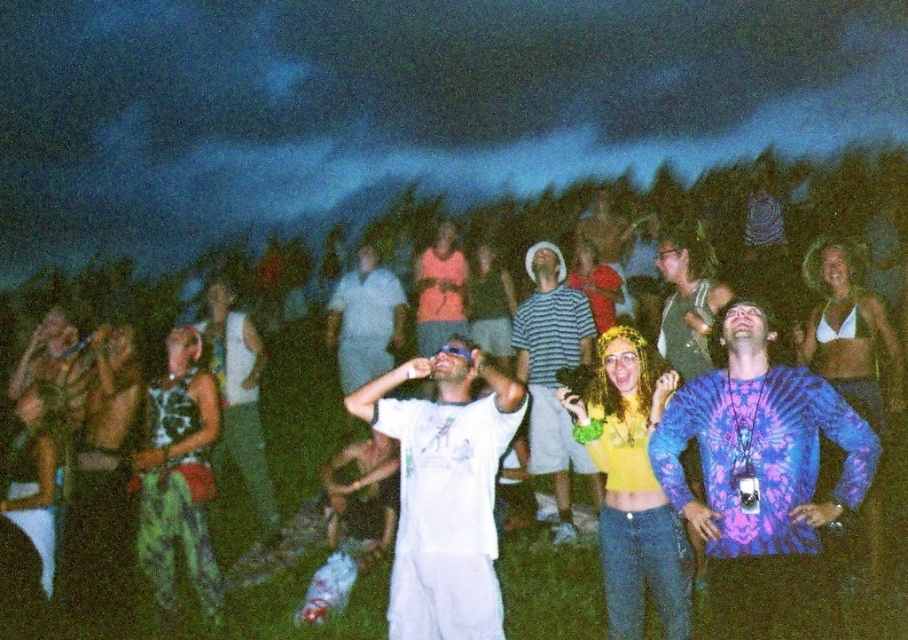
Question: In this image, where is tie-dye fabric shirt at right located relative to striped cotton shirt at center?

Choices:
 (A) left
 (B) right

Answer: (B)

Question: Does striped cotton shirt at center come in front of white cotton shirt at center?

Choices:
 (A) yes
 (B) no

Answer: (A)

Question: Which object is the closest to the striped cotton shirt at center?

Choices:
 (A) tie-dye fabric shirt at right
 (B) white cotton t-shirt at center

Answer: (B)

Question: Among these points, which one is farthest from the camera?

Choices:
 (A) (356, 276)
 (B) (551, 420)
 (C) (775, 472)
 (D) (454, 400)

Answer: (A)

Question: Which is farther from the striped cotton shirt at center?

Choices:
 (A) white cotton t-shirt at center
 (B) tie-dye fabric shirt at right
 (C) white cotton shirt at center

Answer: (C)

Question: Does white cotton t-shirt at center have a lesser width compared to white cotton shirt at center?

Choices:
 (A) no
 (B) yes

Answer: (A)